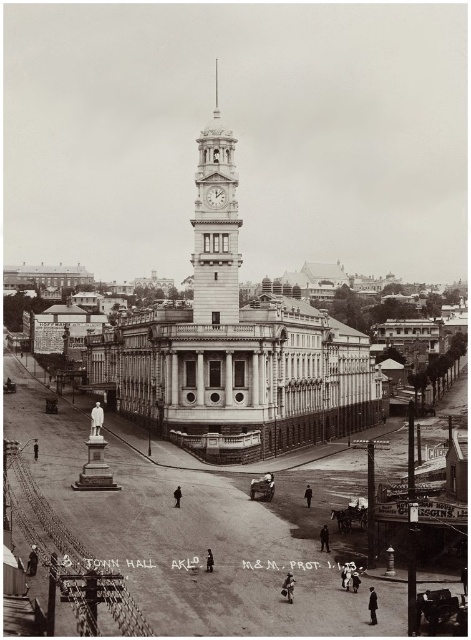
Question: Which point is farther to the camera?

Choices:
 (A) silver metallic spire at upper center
 (B) smooth stone statue at center

Answer: (A)

Question: Which of the following is the closest to the observer?

Choices:
 (A) (205, 243)
 (B) (211, 200)
 (C) (219, 593)
 (D) (216, 100)

Answer: (C)

Question: Is white stone clock tower at center below silver metallic spire at upper center?

Choices:
 (A) no
 (B) yes

Answer: (B)

Question: Which of these objects is positioned farthest from the silver metallic spire at upper center?

Choices:
 (A) white marble clock at upper center
 (B) white stone clock tower at center
 (C) smooth stone statue at center

Answer: (C)

Question: Is white marble clock at upper center further to the viewer compared to silver metallic spire at upper center?

Choices:
 (A) no
 (B) yes

Answer: (A)

Question: Can you confirm if white stone clock tower at center is positioned above white marble clock at upper center?

Choices:
 (A) yes
 (B) no

Answer: (B)